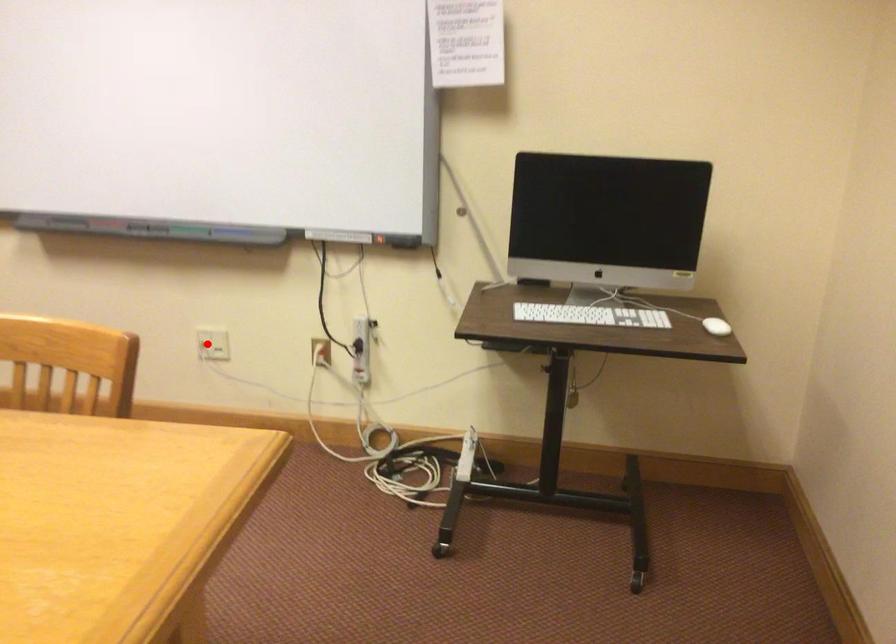
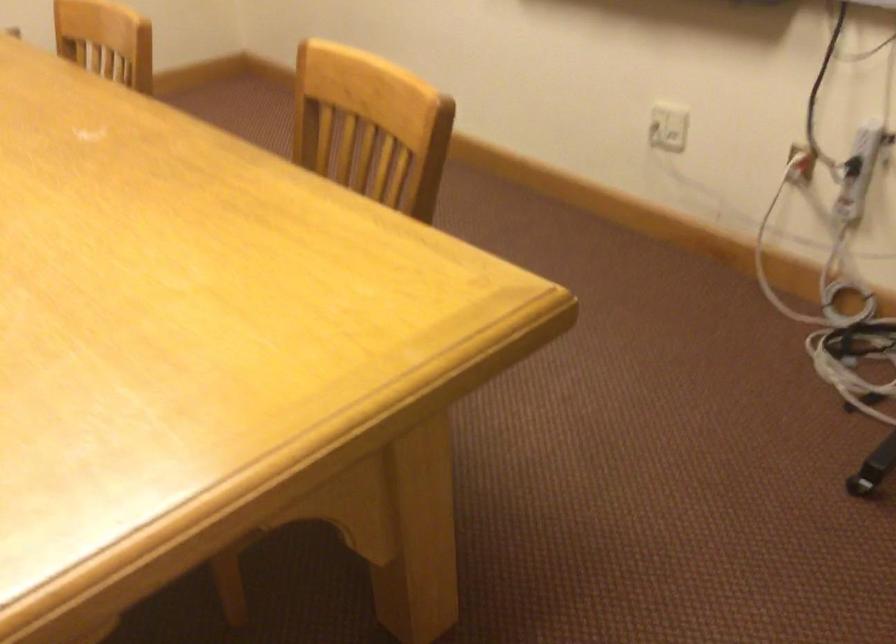
Find the pixel in the second image that matches the highlighted location in the first image.

(668, 127)